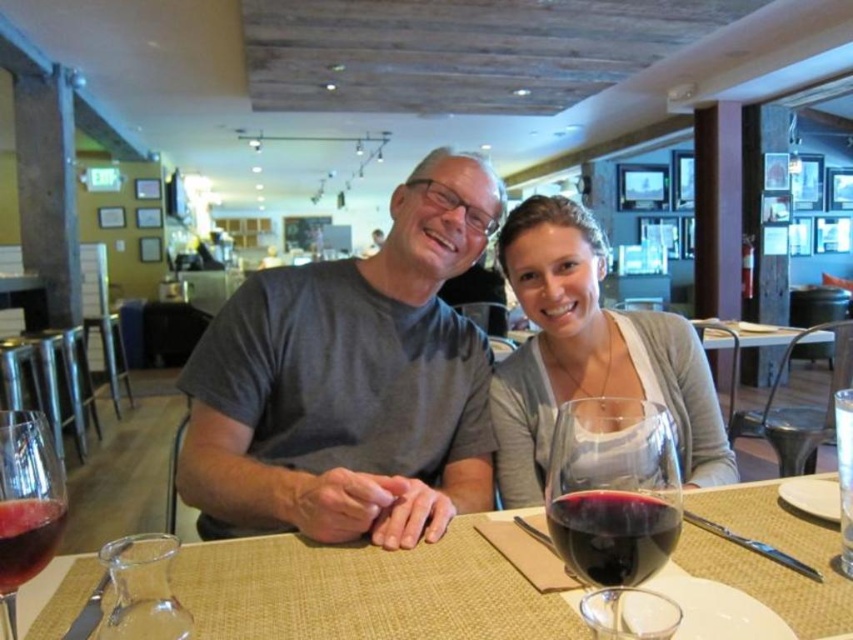
Question: Which point is closer to the camera taking this photo?

Choices:
 (A) (566, 541)
 (B) (263, 445)
 (C) (19, 534)
 (D) (699, 353)

Answer: (C)

Question: Can you confirm if translucent glass wine at center is positioned to the right of translucent glass wine glass at lower left?

Choices:
 (A) no
 (B) yes

Answer: (B)

Question: Which point is farther to the camera?

Choices:
 (A) (572, 413)
 (B) (583, 540)
 (C) (555, 275)

Answer: (C)

Question: Which is nearer to the ruby glass at table center?

Choices:
 (A) gray matte t-shirt at center
 (B) translucent glass wine at center
 (C) matte gray sweater at center
 (D) shiny dark red wine at table center

Answer: (D)

Question: Can you confirm if matte gray sweater at center is positioned to the left of shiny dark red wine at table center?

Choices:
 (A) no
 (B) yes

Answer: (A)

Question: Observing the image, what is the correct spatial positioning of gray matte t-shirt at center in reference to ruby glass at table center?

Choices:
 (A) right
 (B) left

Answer: (A)